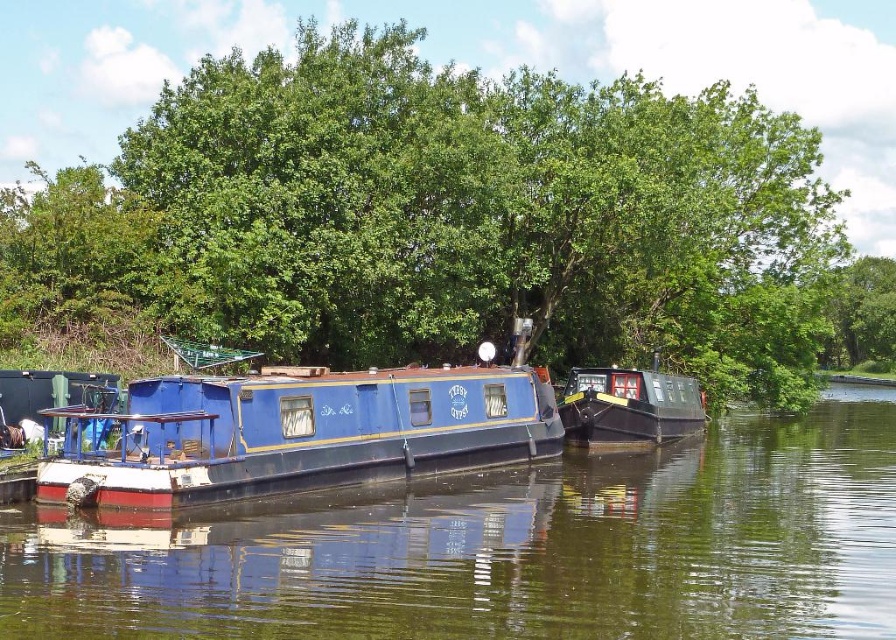
Question: Does matte black boat at center lie behind metallic blue boat at left?

Choices:
 (A) yes
 (B) no

Answer: (A)

Question: Which point is closer to the camera?

Choices:
 (A) matte black boat at center
 (B) metallic blue boat at left
 (C) green leafy tree at upper center

Answer: (B)

Question: Which point is farther to the camera?

Choices:
 (A) (582, 506)
 (B) (48, 404)
 (C) (487, 349)
 (D) (116, 282)

Answer: (D)

Question: Is green leafy tree at upper center positioned before matte black boat at center?

Choices:
 (A) yes
 (B) no

Answer: (A)

Question: Which is farther from the blue glossy boat at center?

Choices:
 (A) metallic blue boat at left
 (B) green leafy tree at upper center
 (C) matte black boat at center

Answer: (B)

Question: Does blue glossy boat at center have a larger size compared to metallic blue boat at left?

Choices:
 (A) yes
 (B) no

Answer: (A)